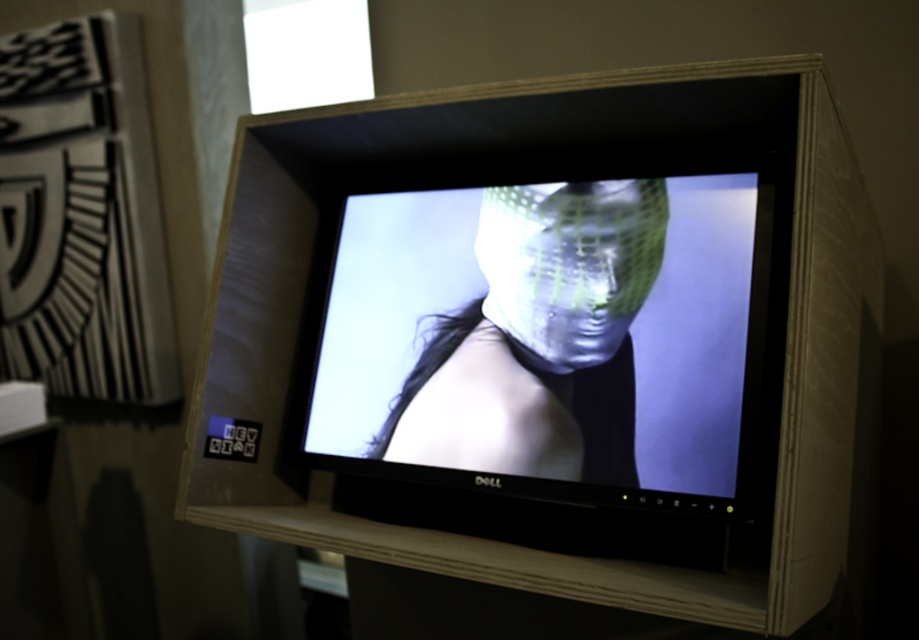
Question: In this image, where is metallic mesh mask at center located relative to translucent plastic mask at center?

Choices:
 (A) left
 (B) right

Answer: (A)

Question: Does metallic mesh mask at center have a smaller size compared to translucent plastic mask at center?

Choices:
 (A) no
 (B) yes

Answer: (A)

Question: Which point is closer to the camera?

Choices:
 (A) translucent plastic mask at center
 (B) metallic mesh mask at center

Answer: (B)

Question: Is metallic mesh mask at center smaller than translucent plastic mask at center?

Choices:
 (A) yes
 (B) no

Answer: (B)